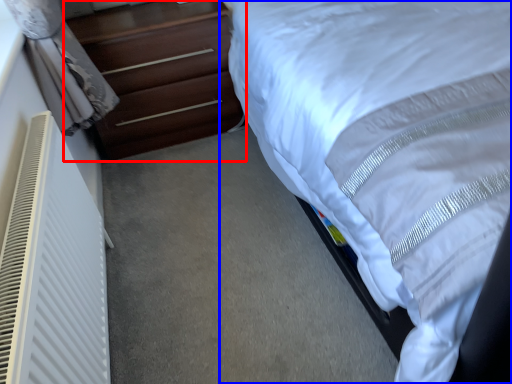
Question: Which of the following is the closest to the observer, chest of drawers (highlighted by a red box) or bed (highlighted by a blue box)?

Choices:
 (A) chest of drawers
 (B) bed

Answer: (B)